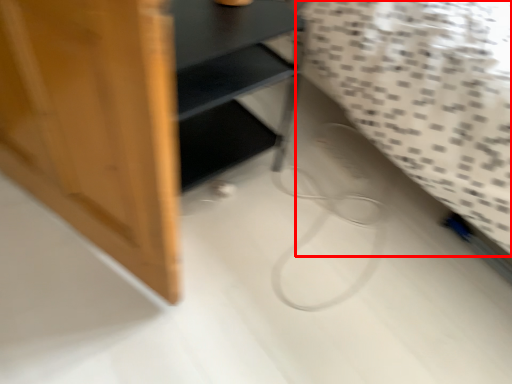
Question: From the image, what is the correct spatial relationship of sheet (annotated by the red box) in relation to furniture?

Choices:
 (A) right
 (B) left

Answer: (A)